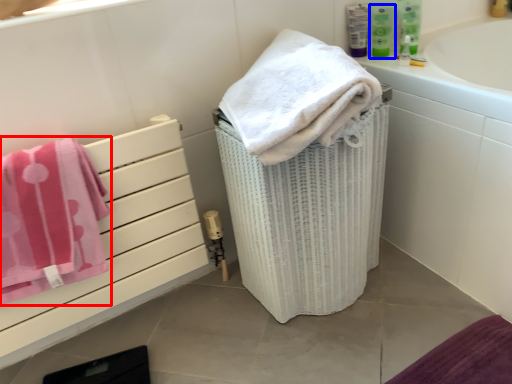
Question: Which of the following is the farthest to the observer, towel (highlighted by a red box) or mouthwash (highlighted by a blue box)?

Choices:
 (A) towel
 (B) mouthwash

Answer: (B)